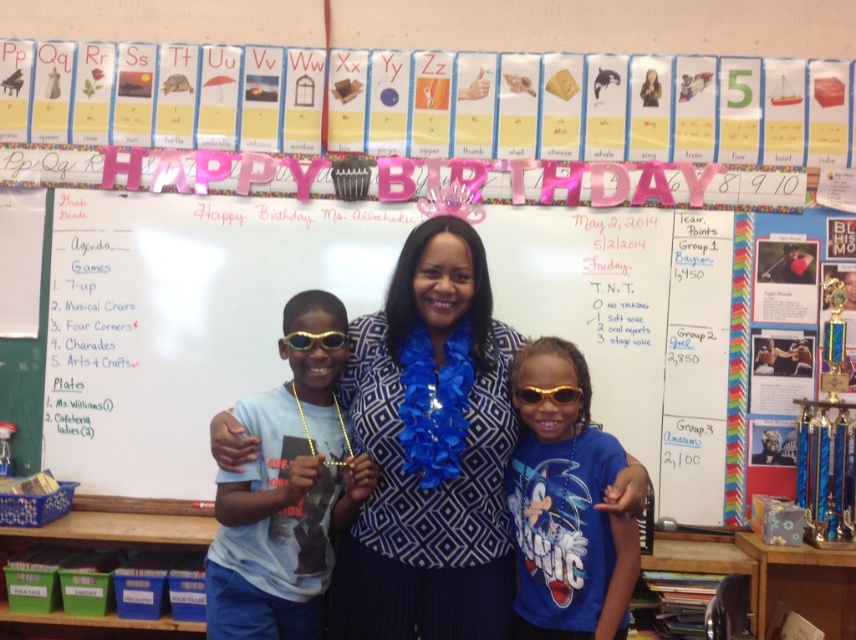
You are a photographer trying to capture the perfect shot of the birthday celebration. You notice two points in the background. The first point is at coordinates point (385, 536) and the second is at point (286, 493). Which point is closer to your camera lens?

Point (385, 536) is further to the viewer than point (286, 493), so the second point is closer to the camera lens.